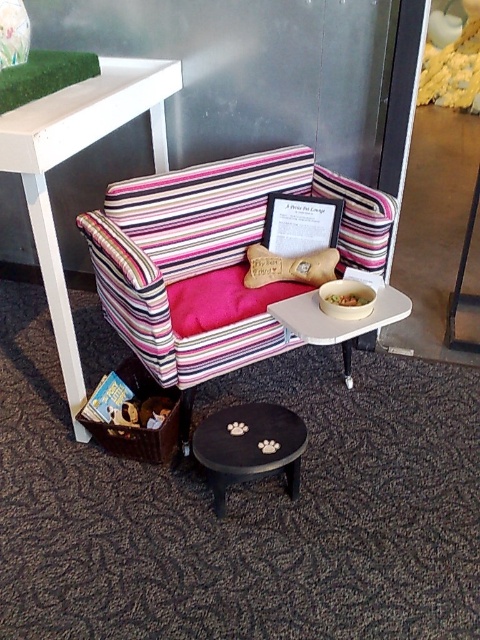
Question: Does striped fabric couch at center lie in front of leather bone at center?

Choices:
 (A) yes
 (B) no

Answer: (A)

Question: Which of the following is the closest to the observer?

Choices:
 (A) (346, 300)
 (B) (71, 344)
 (C) (252, 268)

Answer: (A)

Question: Is striped fabric couch at center above leather bone at center?

Choices:
 (A) yes
 (B) no

Answer: (A)

Question: Which of the following is the closest to the observer?

Choices:
 (A) (131, 196)
 (B) (272, 259)
 (C) (409, 304)

Answer: (C)

Question: Estimate the real-world distances between objects in this image. Which object is farther from the white wood table at upper left?

Choices:
 (A) smooth yellow bowl at center
 (B) striped fabric couch at center

Answer: (A)

Question: Can you confirm if white plastic side table at center is positioned below leather bone at center?

Choices:
 (A) yes
 (B) no

Answer: (A)